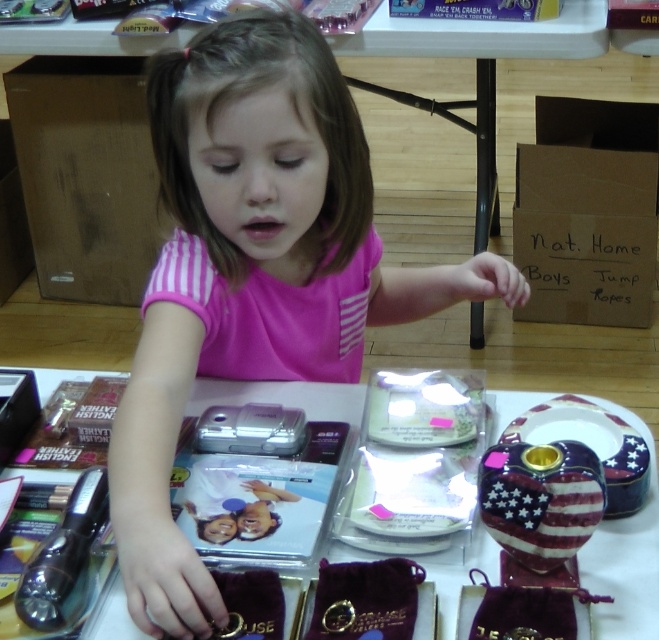
Question: Among these objects, which one is nearest to the camera?

Choices:
 (A) metallic silver flashlight at lower left
 (B) american flag-patterned ceramic vase at lower right
 (C) metallic silver camera at center

Answer: (B)

Question: Considering the relative positions of metallic silver camera at center and silver metallic camera at center in the image provided, where is metallic silver camera at center located with respect to silver metallic camera at center?

Choices:
 (A) right
 (B) left

Answer: (A)

Question: Can you confirm if pink fabric child at center is positioned above metallic silver flashlight at lower left?

Choices:
 (A) no
 (B) yes

Answer: (B)

Question: Which object is farther from the camera taking this photo?

Choices:
 (A) silver metallic camera at center
 (B) american flag-patterned ceramic vase at lower right
 (C) pink fabric child at center

Answer: (A)

Question: Among these points, which one is nearest to the camera?

Choices:
 (A) (646, 435)
 (B) (598, 464)
 (C) (76, 516)

Answer: (B)

Question: Is pink fabric child at center bigger than american flag-patterned ceramic vase at lower right?

Choices:
 (A) no
 (B) yes

Answer: (B)